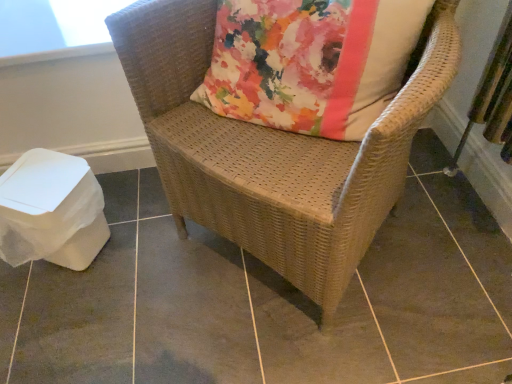
I want to click on vacant space that is to the left of woven wicker chair at center, so click(126, 275).